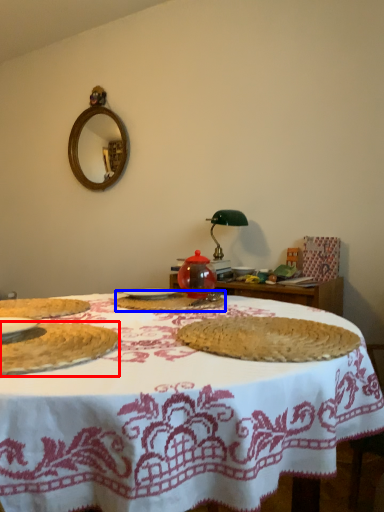
Question: Which object appears closest to the camera in this image, food (highlighted by a red box) or food (highlighted by a blue box)?

Choices:
 (A) food
 (B) food

Answer: (A)